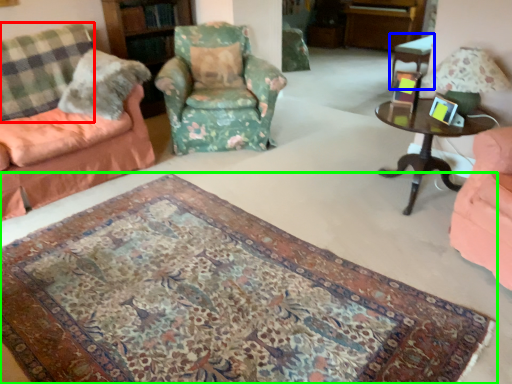
Question: Considering the real-world distances, which object is closest to plaid (highlighted by a red box)? table (highlighted by a blue box) or mat (highlighted by a green box).

Choices:
 (A) table
 (B) mat

Answer: (B)